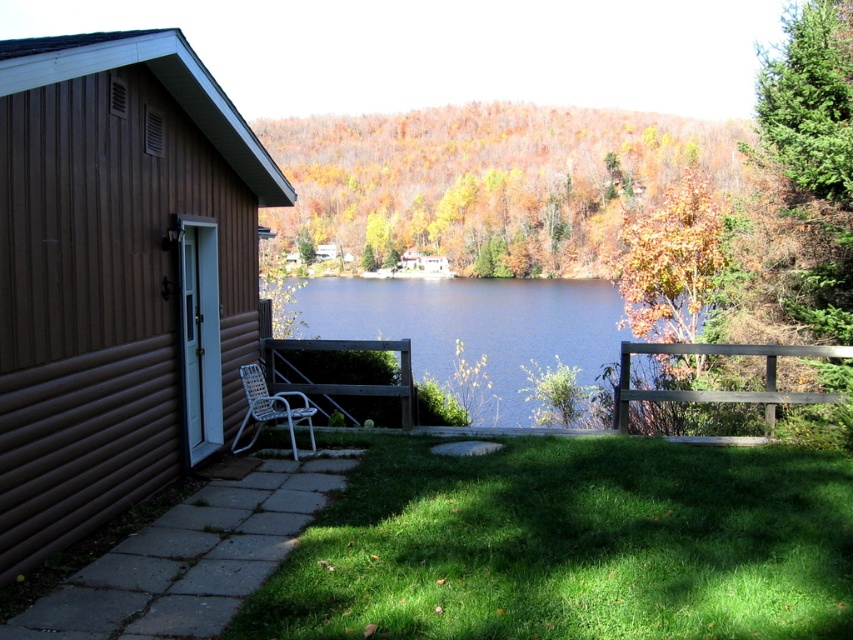
Question: Does blue water at center have a smaller size compared to wooden park bench at center?

Choices:
 (A) yes
 (B) no

Answer: (B)

Question: Estimate the real-world distances between objects in this image. Which object is closer to the white woven chair at lower left?

Choices:
 (A) blue water at center
 (B) brown wooden park bench at right
 (C) wooden park bench at center
 (D) brown wood cabin at left

Answer: (D)

Question: Can you confirm if blue water at center is positioned below white woven chair at lower left?

Choices:
 (A) no
 (B) yes

Answer: (A)

Question: Which is farther from the wooden park bench at center?

Choices:
 (A) blue water at center
 (B) white woven chair at lower left
 (C) brown wood cabin at left
 (D) brown wooden park bench at right

Answer: (A)

Question: Which object appears closest to the camera in this image?

Choices:
 (A) blue water at center
 (B) white woven chair at lower left
 (C) wooden park bench at center
 (D) brown wood cabin at left

Answer: (D)

Question: Does brown wood cabin at left come in front of blue water at center?

Choices:
 (A) no
 (B) yes

Answer: (B)